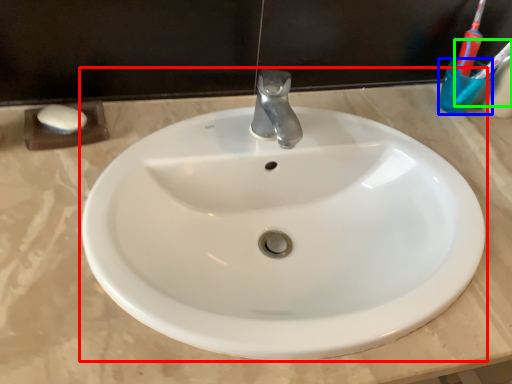
Question: Estimate the real-world distances between objects in this image. Which object is farther from sink (highlighted by a red box), liquid (highlighted by a blue box) or toothbrush (highlighted by a green box)?

Choices:
 (A) liquid
 (B) toothbrush

Answer: (B)